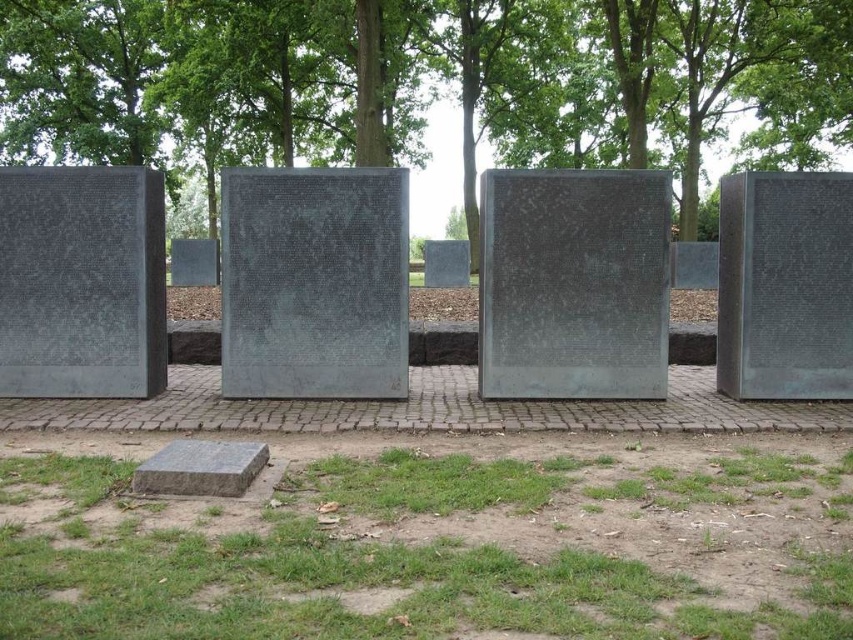
You are standing at the entrance of the memorial walkway and notice the green leafy tree at upper center and the polished bronze plaque at center. Which object is located higher relative to the other?

The green leafy tree at upper center is positioned over the polished bronze plaque at center, meaning it is higher in elevation.

You are standing at the entrance of the memorial walkway and want to place a new commemorative plaque. You have two options for placement based on coordinates given in the scene. Which coordinate point, point (96, 634) or point (576, 209), is closer to where you are currently standing?

Point (96, 634) is closer to the camera than point (576, 209), so the coordinate point (96, 634) is closer to where you are currently standing.

You are standing at the camera position and want to place a 10 feet long banner between yourself and the green grass at lower center. Is there enough space?

The distance between the camera and the green grass at lower center is 9.79 feet, so the banner cannot be placed as it is longer than the available space.